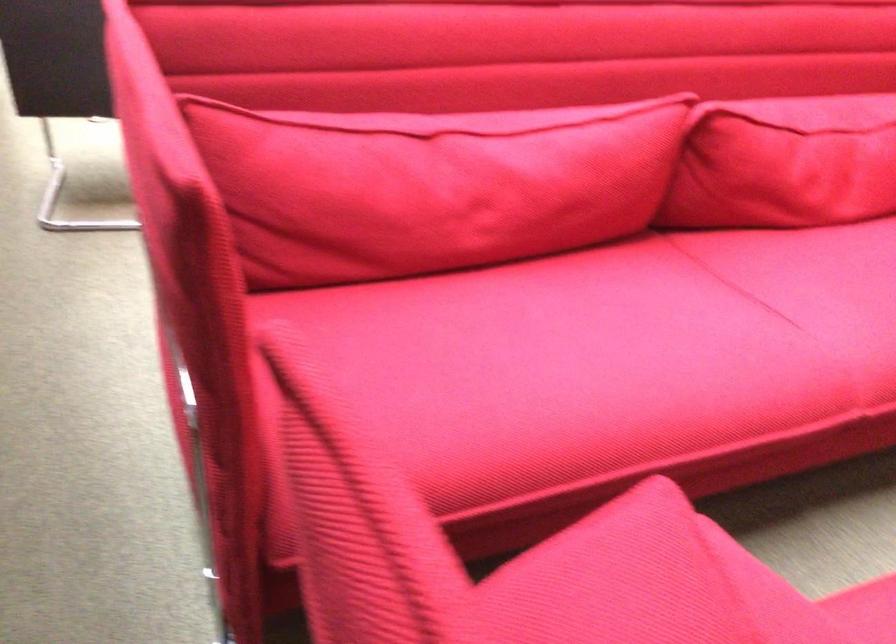
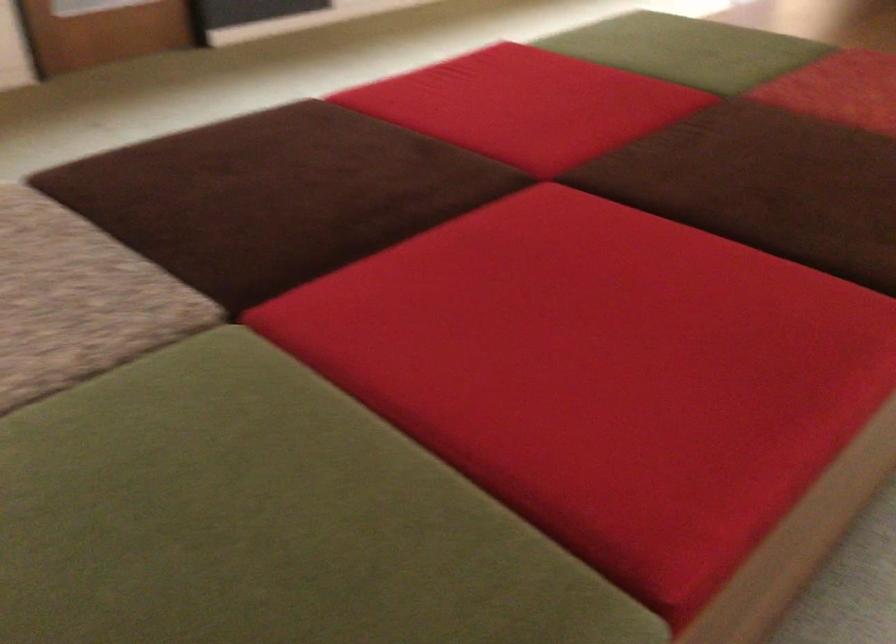
Question: The camera is either moving clockwise (left) or counter-clockwise (right) around the object. The first image is from the beginning of the video and the second image is from the end. Is the camera moving left or right when shooting the video?

Choices:
 (A) Left
 (B) Right

Answer: (B)